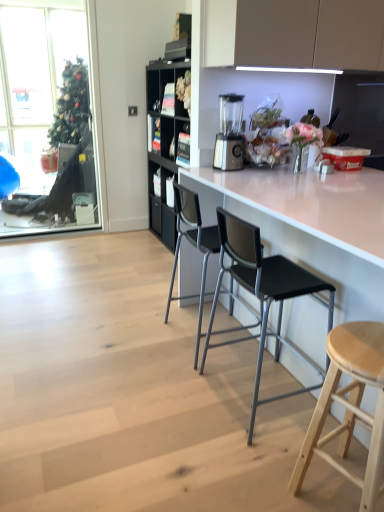
At what (x,y) coordinates should I click in order to perform the action: click on blank space above black plastic chair at center, the second chair from the back (from a real-world perspective). Please return your answer as a coordinate pair (x, y). The height and width of the screenshot is (512, 384). Looking at the image, I should click on (282, 203).